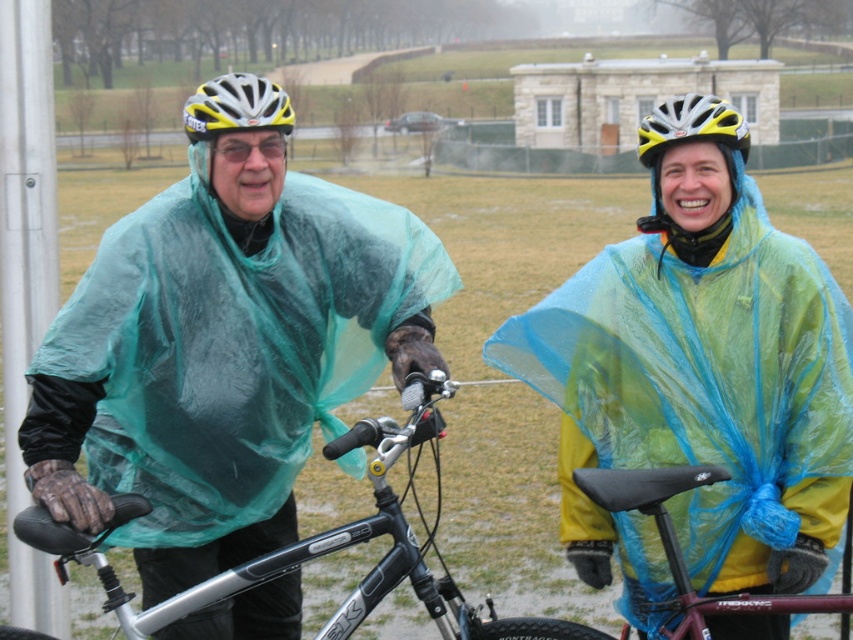
Question: Which point appears farthest from the camera in this image?

Choices:
 (A) (421, 243)
 (B) (151, 625)
 (C) (657, 144)

Answer: (A)

Question: Considering the real-world distances, which object is farthest from the yellow matte helmet at upper left?

Choices:
 (A) yellow matte bicycle helmet at upper center
 (B) black seat at center

Answer: (A)

Question: Which object is positioned farthest from the translucent green poncho at center?

Choices:
 (A) translucent blue poncho at center
 (B) yellow and white matte bicycle helmet at upper center
 (C) silver metallic bicycle at center

Answer: (B)

Question: Does yellow matte helmet at upper left have a smaller size compared to yellow matte bicycle helmet at upper center?

Choices:
 (A) no
 (B) yes

Answer: (B)

Question: Is translucent green poncho at center below yellow matte bicycle helmet at upper center?

Choices:
 (A) no
 (B) yes

Answer: (B)

Question: From the image, what is the correct spatial relationship of translucent green poncho at center in relation to silver metallic bicycle at center?

Choices:
 (A) above
 (B) below

Answer: (A)